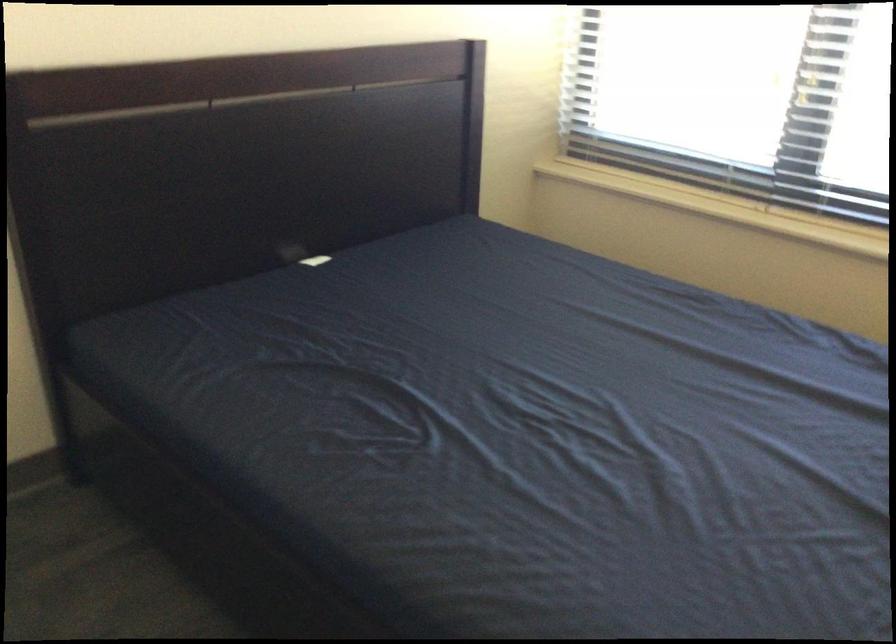
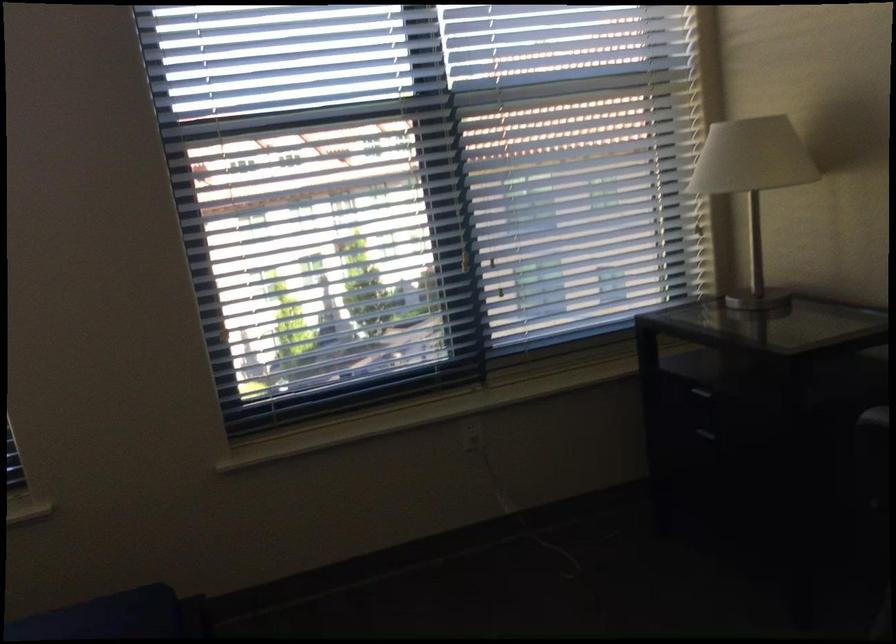
Question: The camera is either moving clockwise (left) or counter-clockwise (right) around the object. The first image is from the beginning of the video and the second image is from the end. Is the camera moving left or right when shooting the video?

Choices:
 (A) Left
 (B) Right

Answer: (A)